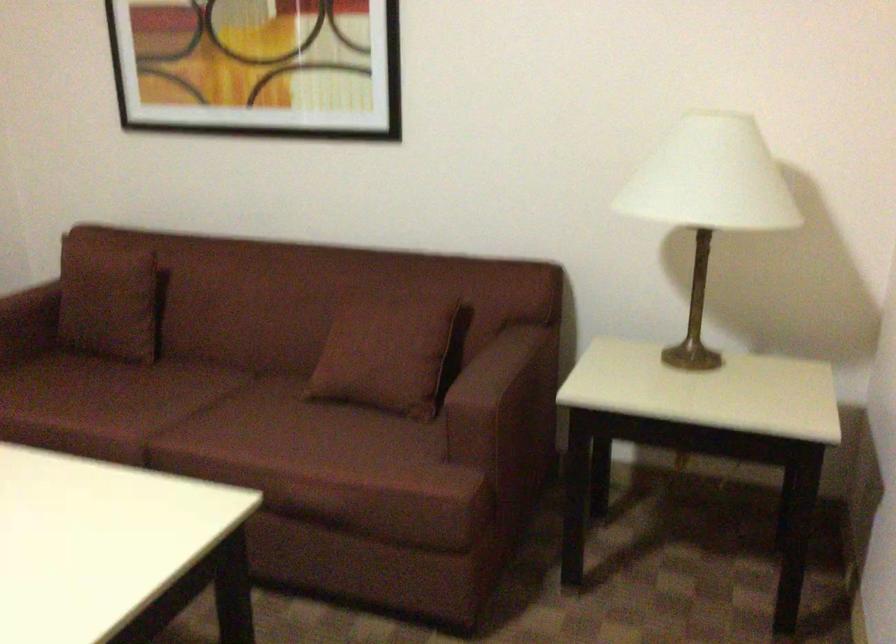
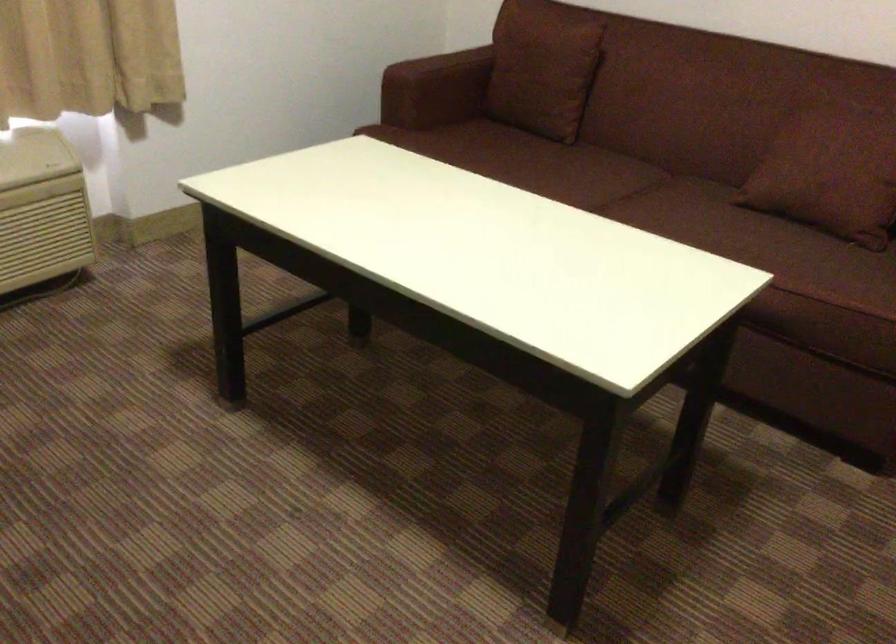
Find the pixel in the second image that matches point 391,395 in the first image.

(842, 207)